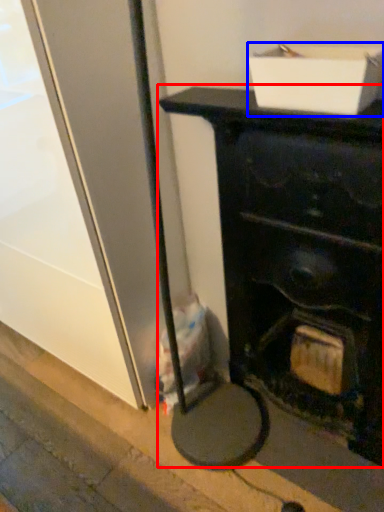
Question: Which object is closer to the camera taking this photo, furniture (highlighted by a red box) or cardboard box (highlighted by a blue box)?

Choices:
 (A) furniture
 (B) cardboard box

Answer: (A)